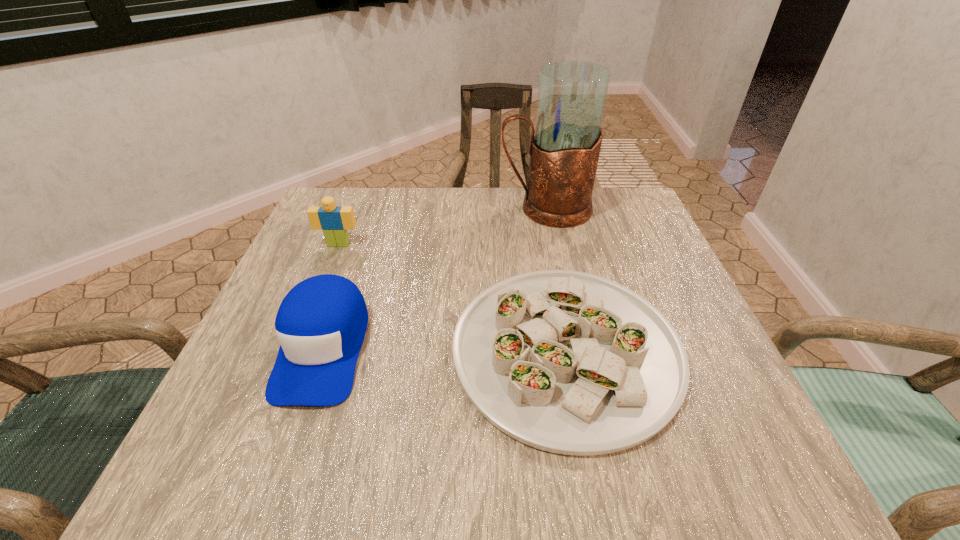
Find the location of a particular element. This screenshot has width=960, height=540. the farthest object is located at coordinates (564, 152).

Locate an element on the screen. pitcher is located at coordinates (564, 152).

Locate an element on the screen. Lego is located at coordinates (335, 220).

I want to click on baseball cap, so click(321, 323).

The image size is (960, 540). What are the coordinates of `platter` in the screenshot? It's located at pyautogui.click(x=568, y=362).

Locate an element on the screen. vacant position located with the handle on the side of the pitcher is located at coordinates (440, 208).

I want to click on free space located with the handle on the side of the pitcher, so click(x=436, y=208).

Locate an element on the screen. The height and width of the screenshot is (540, 960). vacant space located with the handle on the side of the pitcher is located at coordinates (348, 208).

Find the location of `free region located on the face of the second farthest object`. free region located on the face of the second farthest object is located at coordinates (320, 290).

At what (x,y) coordinates should I click in order to perform the action: click on free region located 0.090m on the front-facing side of the baseball cap. Please return your answer as a coordinate pair (x, y). Looking at the image, I should click on pos(282,467).